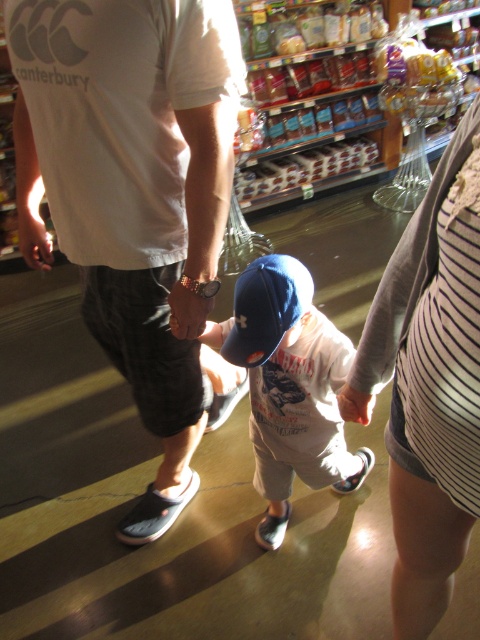
Is matte blue cap at center thinner than blue fabric cap at center?

No, matte blue cap at center is not thinner than blue fabric cap at center.

How much distance is there between matte blue cap at center and blue fabric cap at center?

matte blue cap at center is 14.91 centimeters away from blue fabric cap at center.

Is point (325, 392) closer to camera compared to point (290, 268)?

No.

This screenshot has width=480, height=640. What are the coordinates of `matte blue cap at center` in the screenshot? It's located at (289, 387).

Does white cotton t-shirt at center lie in front of matte blue cap at center?

That is True.

Where is `white cotton t-shirt at center`? Image resolution: width=480 pixels, height=640 pixels. white cotton t-shirt at center is located at coordinates (135, 196).

The image size is (480, 640). I want to click on white cotton t-shirt at center, so click(x=135, y=196).

Can you confirm if white cotton t-shirt at center is wider than blue fabric cap at center?

Yes.

Is white cotton t-shirt at center smaller than blue fabric cap at center?

No.

Does point (148, 65) come farther from viewer compared to point (268, 307)?

No, it is not.

At what (x,y) coordinates should I click in order to perform the action: click on white cotton t-shirt at center. Please return your answer as a coordinate pair (x, y). Looking at the image, I should click on (135, 196).